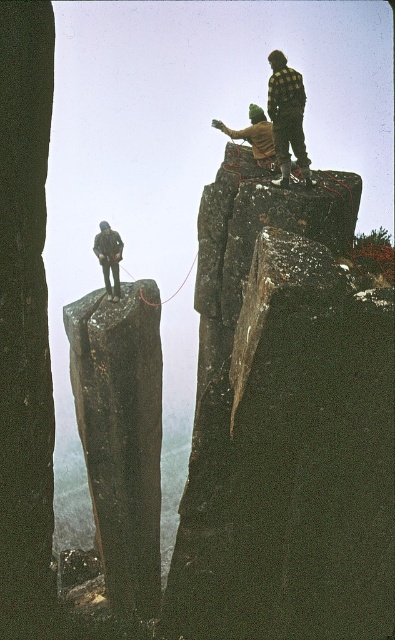
Question: Which point is farther from the camera taking this photo?

Choices:
 (A) (118, 275)
 (B) (300, 115)

Answer: (A)

Question: Among these objects, which one is farthest from the camera?

Choices:
 (A) camouflage jacket at left
 (B) checkered flannel shirt at upper right

Answer: (A)

Question: Is checkered flannel shirt at upper right bigger than camouflage jacket at left?

Choices:
 (A) yes
 (B) no

Answer: (A)

Question: Which point appears farthest from the camera in this image?

Choices:
 (A) (297, 93)
 (B) (120, 237)

Answer: (B)

Question: In this image, where is checkered flannel shirt at upper right located relative to camouflage jacket at left?

Choices:
 (A) above
 (B) below

Answer: (A)

Question: Does checkered flannel shirt at upper right have a greater width compared to camouflage jacket at left?

Choices:
 (A) no
 (B) yes

Answer: (B)